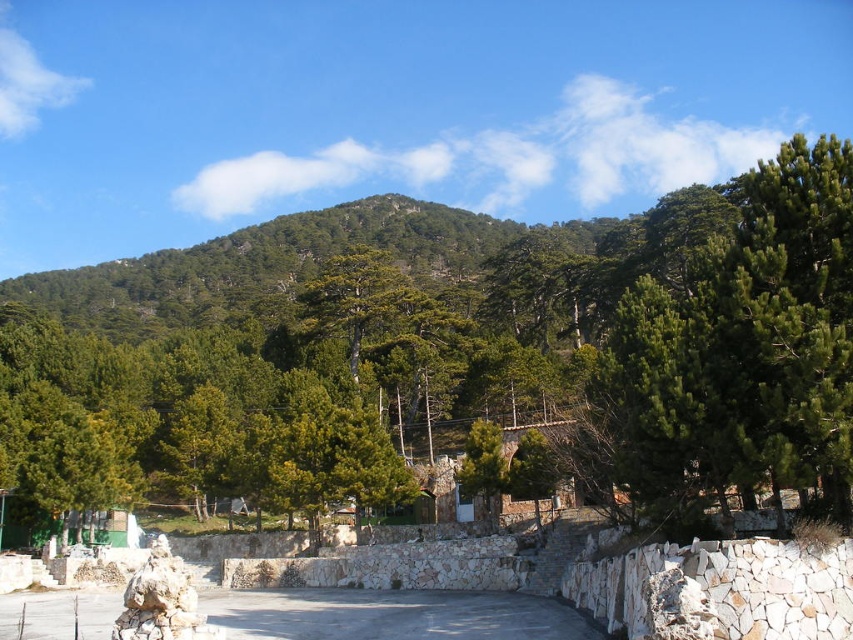
You are standing in front of the stone wall in the midground of the forest scene. You notice two points marked on the image at coordinates point (621,416) and point (822,333). If you want to reach the point closer to you first, which coordinate should you head towards?

Point (621,416) is closer to you than point (822,333), so you should head towards point (621,416) first.

You are standing at the point marked as point (715,445) in the image. A friend is standing 27.89 meters away from you. If you want to meet your friend, which direction should you walk to reach them?

Since the friend is 27.89 meters away from point (715,445), you should walk towards the direction where your friend is located to meet them.

You are standing at the point marked as point (463, 356) in the image. What is the immediate surface you are standing on?

The point (463, 356) is on green textured tree at center, so you are standing on the surface of the green textured tree at center.